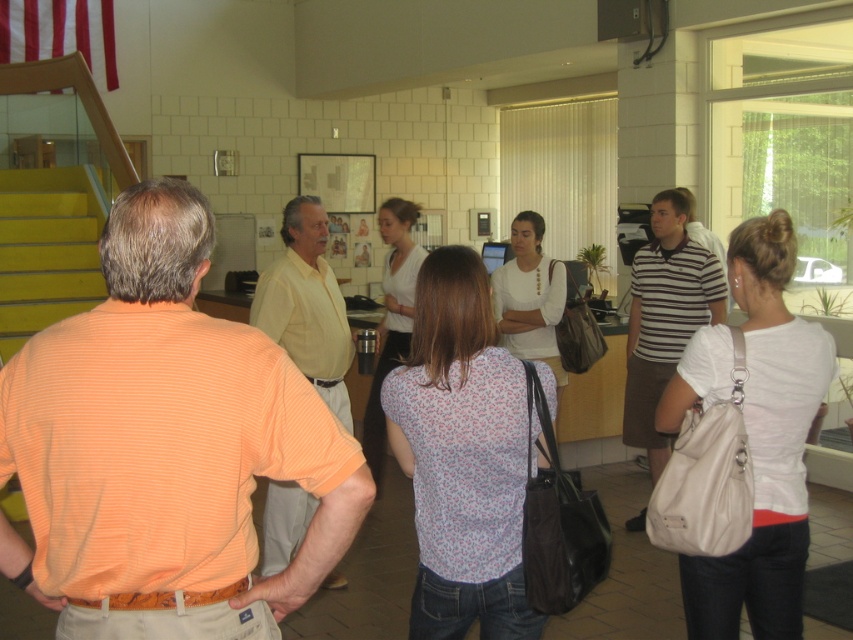
Which of these two, orange striped shirt at center or yellow smooth shirt at center, stands taller?

yellow smooth shirt at center

Between orange striped shirt at center and yellow smooth shirt at center, which one appears on the right side from the viewer's perspective?

From the viewer's perspective, orange striped shirt at center appears more on the right side.

You are a GUI agent. You are given a task and a screenshot of the screen. Output one action in this format:
    pyautogui.click(x=<x>, y=<y>)
    Task: Click on the orange striped shirt at center
    
    Given the screenshot: What is the action you would take?
    pyautogui.click(x=165, y=448)

Can you confirm if yellow smooth shirt at center is smaller than striped cotton polo shirt at center?

No.

Who is higher up, yellow smooth shirt at center or striped cotton polo shirt at center?

Positioned higher is yellow smooth shirt at center.

Where is `yellow smooth shirt at center`? This screenshot has height=640, width=853. yellow smooth shirt at center is located at coordinates (306, 305).

Measure the distance from orange striped shirt at center to striped cotton polo shirt at center.

13.66 feet

Who is more distant from viewer, (347,481) or (670,326)?

Point (670,326)

At what (x,y) coordinates should I click in order to perform the action: click on orange striped shirt at center. Please return your answer as a coordinate pair (x, y). Looking at the image, I should click on (165, 448).